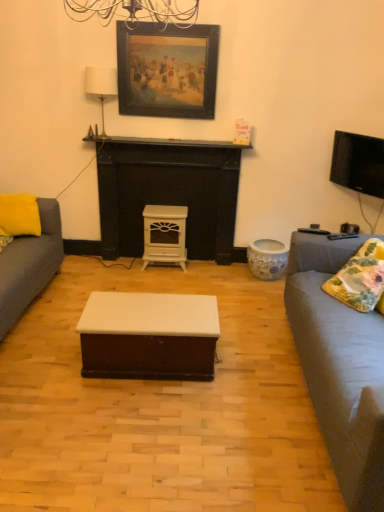
Question: Is white glossy wood stove at center outside of white glossy wood fireplace at center?

Choices:
 (A) no
 (B) yes

Answer: (A)

Question: From the image's perspective, is white glossy wood stove at center located above white glossy wood fireplace at center?

Choices:
 (A) no
 (B) yes

Answer: (A)

Question: Is white glossy wood stove at center at the right side of white glossy wood fireplace at center?

Choices:
 (A) no
 (B) yes

Answer: (A)

Question: Considering the relative positions of white glossy wood stove at center and white glossy wood fireplace at center in the image provided, is white glossy wood stove at center in front of white glossy wood fireplace at center?

Choices:
 (A) no
 (B) yes

Answer: (A)

Question: Considering the relative sizes of white glossy wood stove at center and white glossy wood fireplace at center in the image provided, is white glossy wood stove at center bigger than white glossy wood fireplace at center?

Choices:
 (A) no
 (B) yes

Answer: (A)

Question: From the image's perspective, does white glossy wood stove at center appear lower than white glossy wood fireplace at center?

Choices:
 (A) yes
 (B) no

Answer: (A)

Question: Considering the relative sizes of white matte wood coffee table at center and flat screen tv at upper right in the image provided, is white matte wood coffee table at center smaller than flat screen tv at upper right?

Choices:
 (A) no
 (B) yes

Answer: (A)

Question: Can you confirm if white matte wood coffee table at center is shorter than flat screen tv at upper right?

Choices:
 (A) no
 (B) yes

Answer: (B)

Question: Is white matte wood coffee table at center at the left side of flat screen tv at upper right?

Choices:
 (A) yes
 (B) no

Answer: (A)

Question: Can you confirm if white matte wood coffee table at center is thinner than flat screen tv at upper right?

Choices:
 (A) no
 (B) yes

Answer: (A)

Question: Is white matte wood coffee table at center far from flat screen tv at upper right?

Choices:
 (A) no
 (B) yes

Answer: (B)

Question: Is flat screen tv at upper right a part of white matte wood coffee table at center?

Choices:
 (A) yes
 (B) no

Answer: (B)

Question: From the image's perspective, is floral fabric pillow at right, which ranks as the first pillow in bottom-to-top order, located above white matte wood coffee table at center?

Choices:
 (A) no
 (B) yes

Answer: (B)